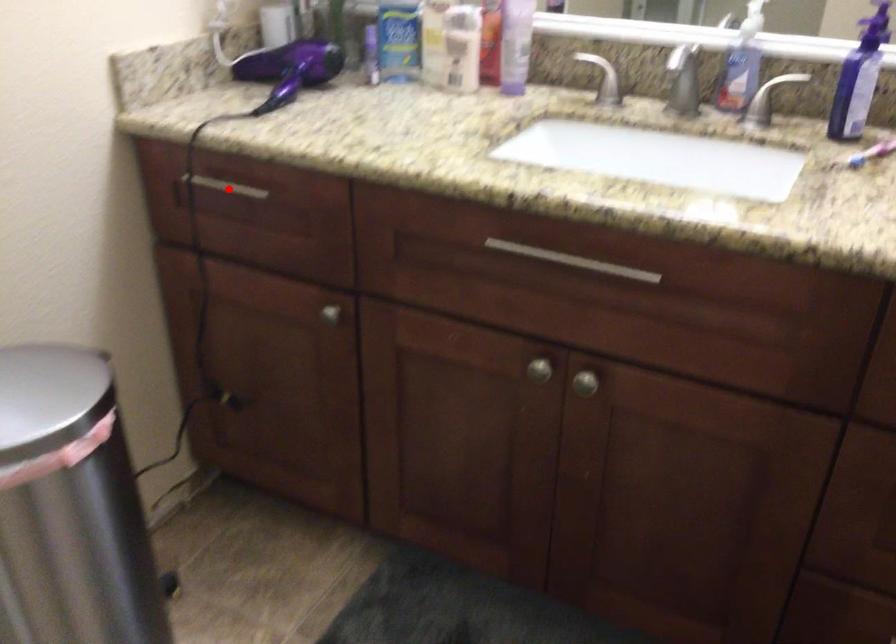
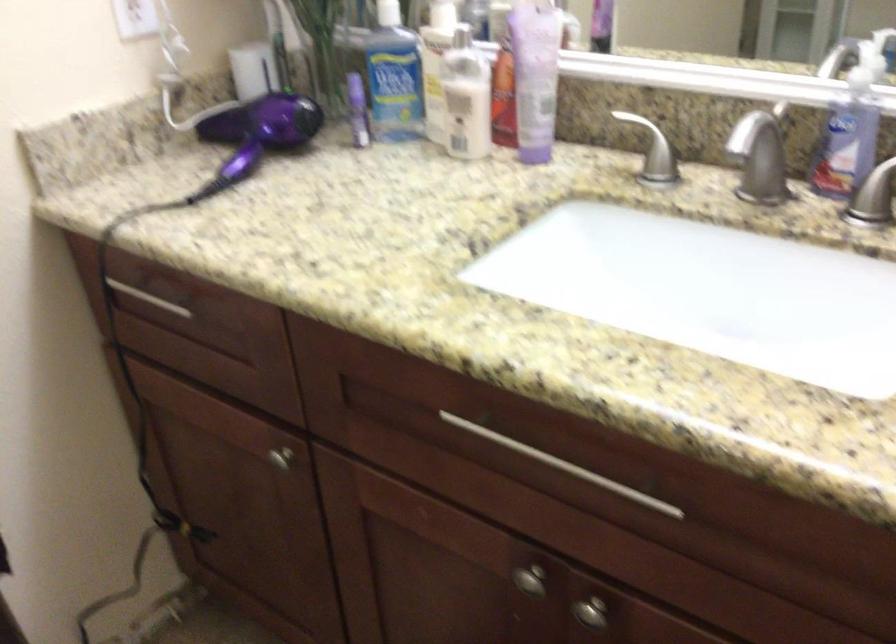
Locate, in the second image, the point that corresponds to the highlighted location in the first image.

(149, 298)